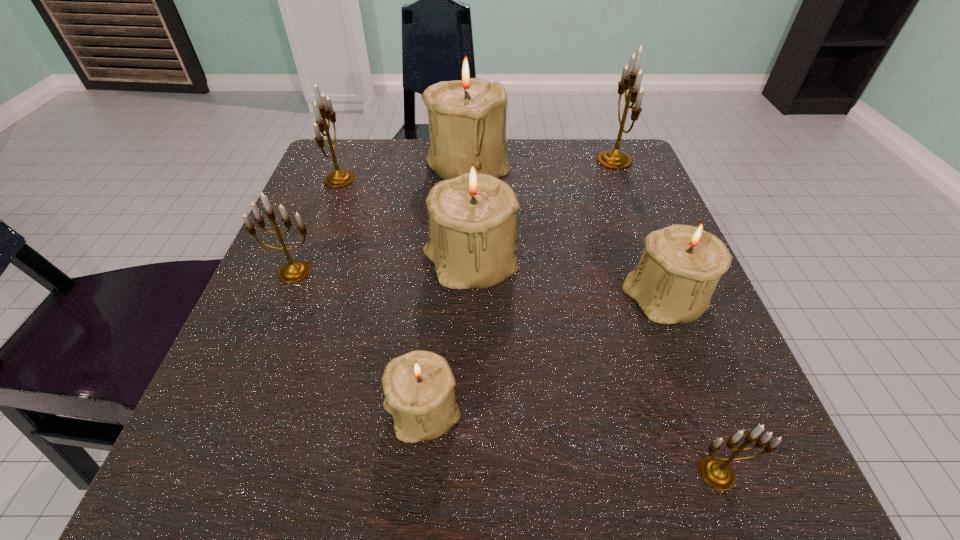
Identify which candelabrum is located as the seventh nearest to the second biggest gold candelabrum. Please provide its 2D coordinates. Your answer should be formatted as a tuple, i.e. [(x, y)], where the tuple contains the x and y coordinates of a point satisfying the conditions above.

[(716, 472)]

Where is `the third closest beige candle_holder to the third biggest beige candle_holder`? This screenshot has width=960, height=540. the third closest beige candle_holder to the third biggest beige candle_holder is located at coordinates (468, 114).

Image resolution: width=960 pixels, height=540 pixels. What are the coordinates of `beige candle_holder that stands as the third closest to the rightmost beige candle_holder` in the screenshot? It's located at (468, 114).

Select which gold candelabrum is the fourth closest to the third smallest beige candle_holder. Please provide its 2D coordinates. Your answer should be formatted as a tuple, i.e. [(x, y)], where the tuple contains the x and y coordinates of a point satisfying the conditions above.

[(716, 472)]

You are a GUI agent. You are given a task and a screenshot of the screen. Output one action in this format:
    pyautogui.click(x=<x>, y=<y>)
    Task: Click on the gold candelabrum that stands as the closest to the nearest gold candelabrum
    
    Given the screenshot: What is the action you would take?
    pyautogui.click(x=293, y=271)

I want to click on vacant region that satisfies the following two spatial constraints: 1. on the front side of the third smallest beige candle_holder; 2. on the left side of the nearest object, so click(466, 473).

Identify the location of free space that satisfies the following two spatial constraints: 1. on the back side of the rightmost beige candle_holder; 2. on the right side of the seventh farthest candelabrum. The height and width of the screenshot is (540, 960). (433, 300).

Where is `free location that satisfies the following two spatial constraints: 1. on the front side of the third smallest gold candelabrum; 2. on the right side of the third smallest beige candle_holder`? This screenshot has height=540, width=960. free location that satisfies the following two spatial constraints: 1. on the front side of the third smallest gold candelabrum; 2. on the right side of the third smallest beige candle_holder is located at coordinates (306, 264).